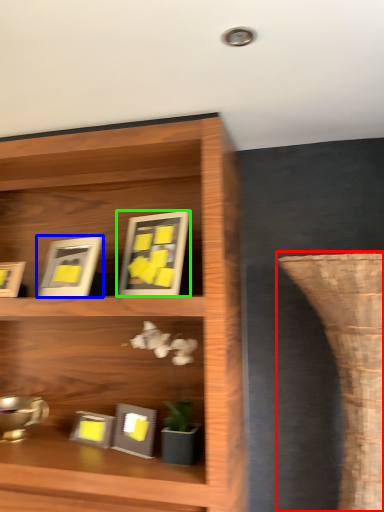
Question: Considering the real-world distances, which object is farthest from vase (highlighted by a red box)? picture frame (highlighted by a blue box) or picture frame (highlighted by a green box)?

Choices:
 (A) picture frame
 (B) picture frame

Answer: (A)